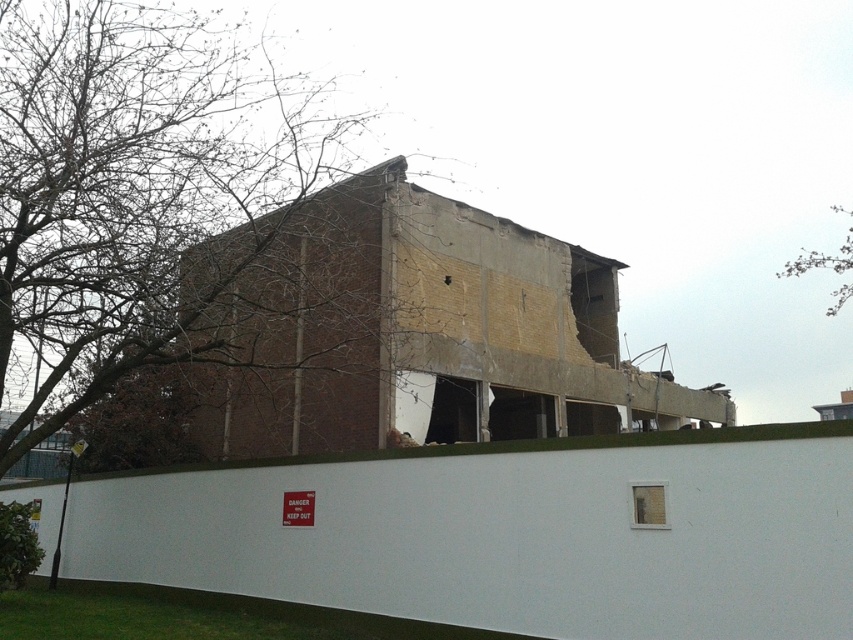
Can you confirm if bare branches at upper left is positioned to the left of bare branches at upper right?

Yes, bare branches at upper left is to the left of bare branches at upper right.

From the picture: Does bare branches at upper left have a lesser height compared to bare branches at upper right?

Incorrect, bare branches at upper left's height does not fall short of bare branches at upper right's.

Identify the location of bare branches at upper left. [x=136, y=189].

Find the location of `bare branches at upper left`. bare branches at upper left is located at coordinates pyautogui.click(x=136, y=189).